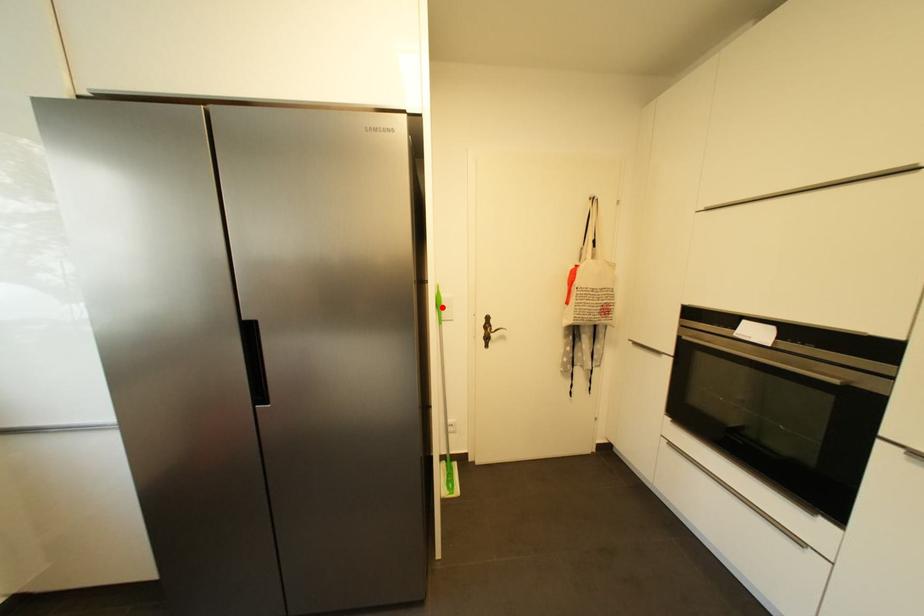
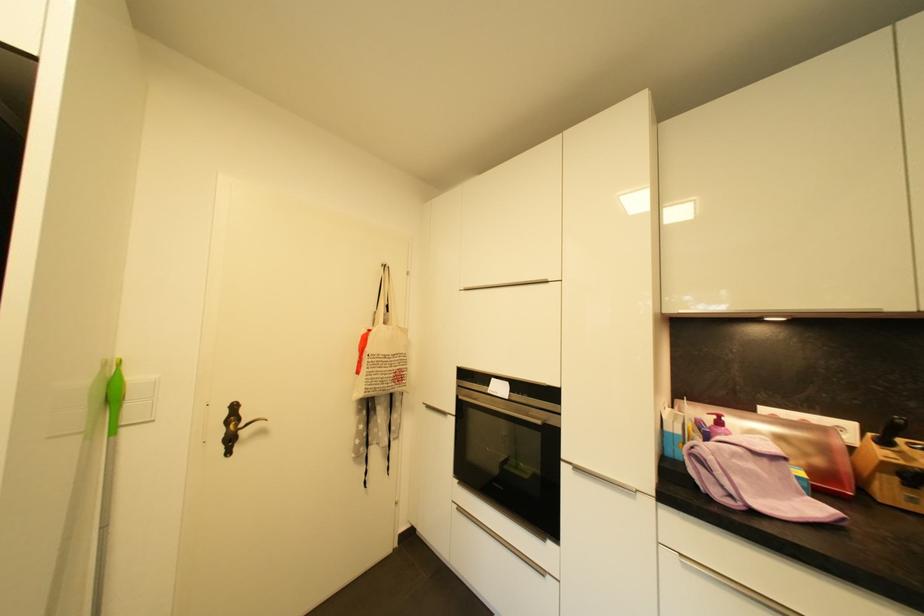
Where in the second image is the point corresponding to the highlighted location from the first image?

(116, 400)